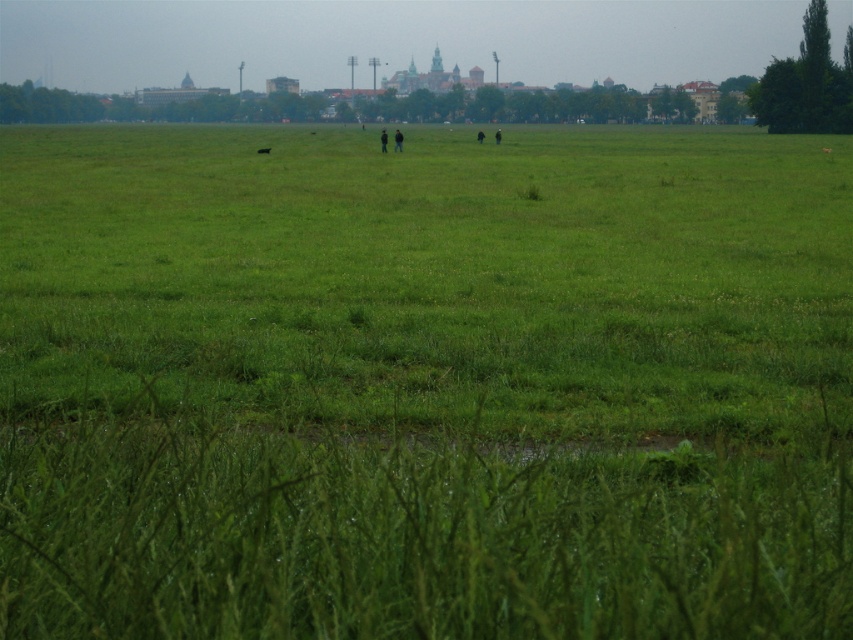
Question: Which object is positioned farthest from the black matte person at center?

Choices:
 (A) green grass at center
 (B) dark green grass at center

Answer: (B)

Question: Does dark blue jacket at center have a greater width compared to black matte person at center?

Choices:
 (A) yes
 (B) no

Answer: (B)

Question: Is green grass pasture at center wider than dark green grass at center?

Choices:
 (A) yes
 (B) no

Answer: (A)

Question: Is dark blue jacket at center closer to the viewer compared to green grass at center?

Choices:
 (A) no
 (B) yes

Answer: (A)

Question: Estimate the real-world distances between objects in this image. Which object is closer to the green grass at center?

Choices:
 (A) green grass pasture at center
 (B) dark green grass at center
 (C) dark blue jacket at center
 (D) black matte person at center

Answer: (C)

Question: Which of these objects is positioned closest to the green grass pasture at center?

Choices:
 (A) dark green grass at center
 (B) black matte person at center

Answer: (B)